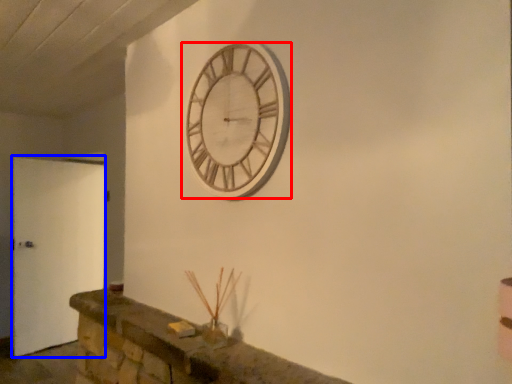
Question: Which point is further to the camera, wall clock (highlighted by a red box) or door (highlighted by a blue box)?

Choices:
 (A) wall clock
 (B) door

Answer: (B)